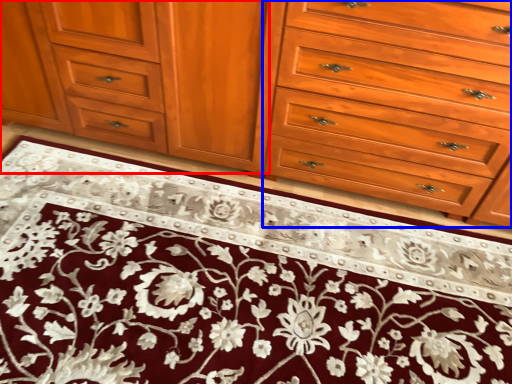
Question: Which point is further to the camera, cabinetry (highlighted by a red box) or drawer (highlighted by a blue box)?

Choices:
 (A) cabinetry
 (B) drawer

Answer: (A)